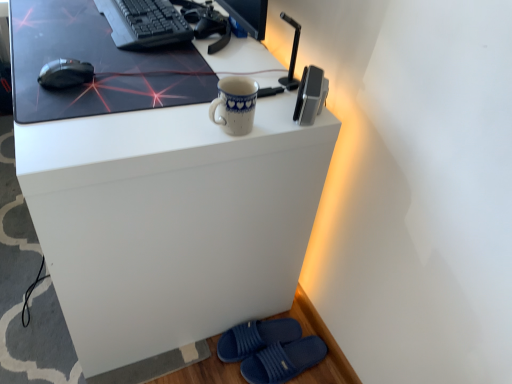
Question: Looking at their shapes, would you say blue fabric slippers at lower right, which ranks as the second footwear in bottom-to-top order, is wider or thinner than blue porcelain mug at upper center?

Choices:
 (A) thin
 (B) wide

Answer: (B)

Question: From the image's perspective, is blue fabric slippers at lower right, which ranks as the second footwear in bottom-to-top order, positioned above or below blue porcelain mug at upper center?

Choices:
 (A) below
 (B) above

Answer: (A)

Question: Which of these objects is positioned closest to the satin silver speaker at upper right?

Choices:
 (A) blue porcelain mug at upper center
 (B) white glossy desk at center
 (C) blue rubber slippers at lower right, marked as the second footwear in a top-to-bottom arrangement
 (D) black matte keyboard at upper left
 (E) blue fabric slippers at lower right, which ranks as the 1th footwear in top-to-bottom order

Answer: (A)

Question: Estimate the real-world distances between objects in this image. Which object is farther from the blue fabric slippers at lower right, which ranks as the second footwear in bottom-to-top order?

Choices:
 (A) blue rubber slippers at lower right, marked as the second footwear in a top-to-bottom arrangement
 (B) black matte mouse at left
 (C) satin silver speaker at upper right
 (D) blue porcelain mug at upper center
 (E) matte black mousepad at upper center

Answer: (B)